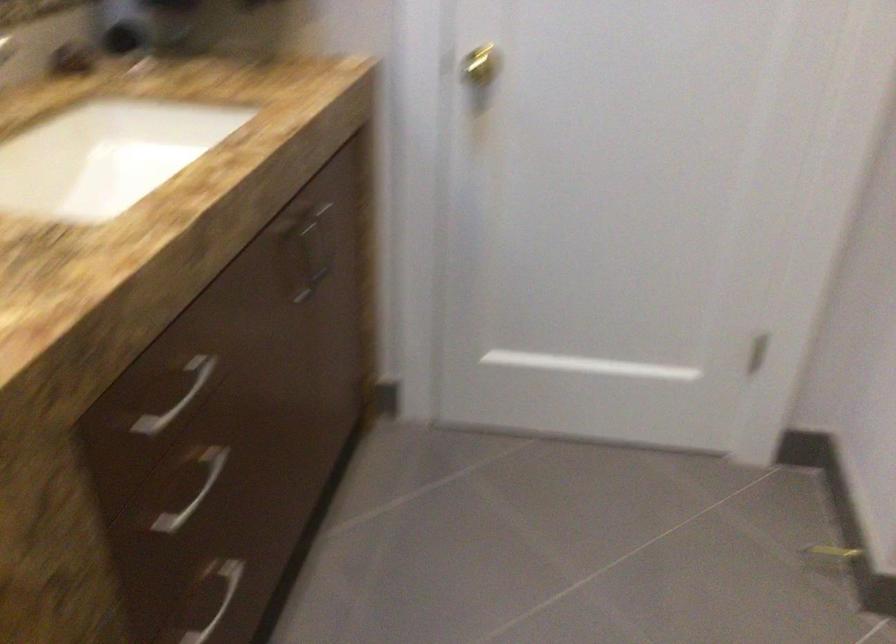
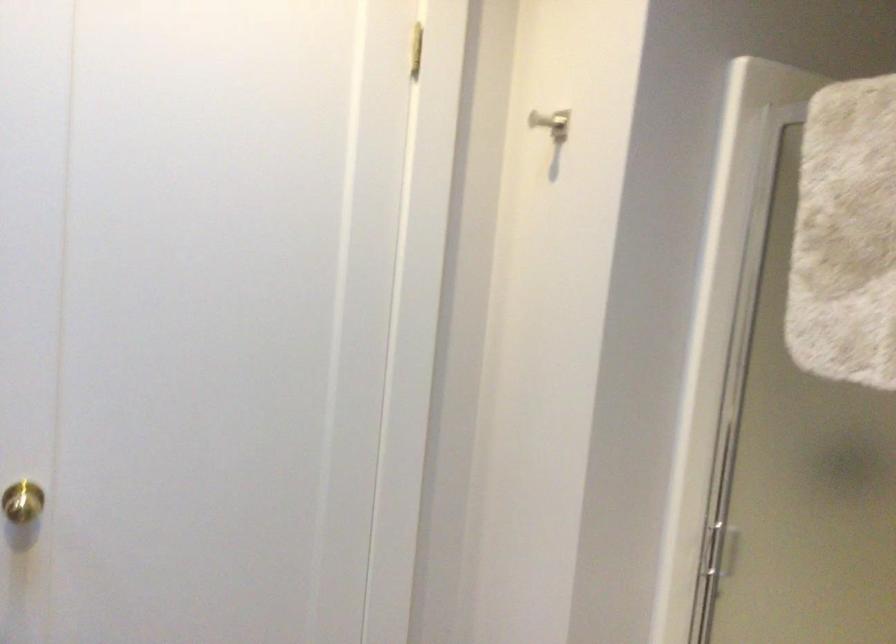
The first image is from the beginning of the video and the second image is from the end. How did the camera likely rotate when shooting the video?

The camera rotated toward right-up.